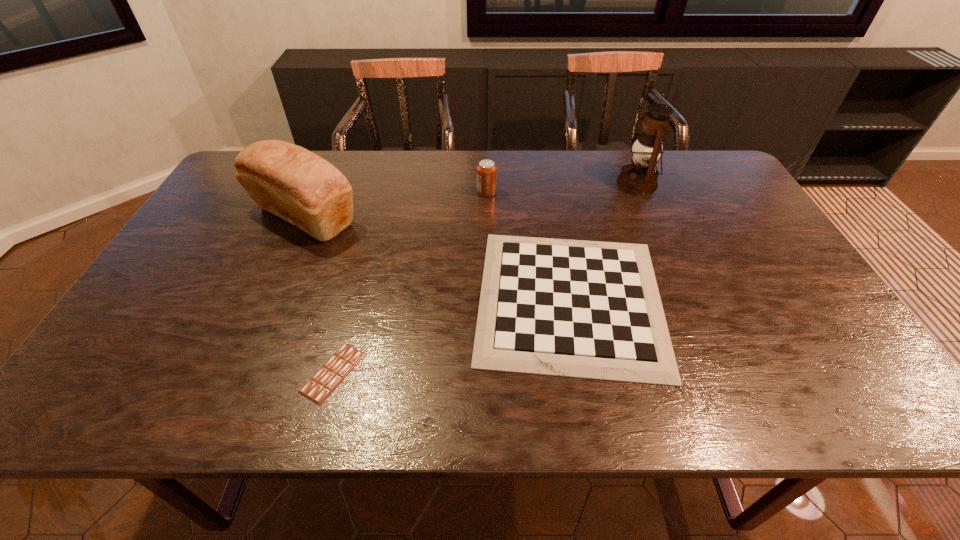
Identify the location of free spot between the second tallest object and the second shortest object. (438, 258).

Find the location of a particular element. free area in between the chocolate bar and the third shortest object is located at coordinates (410, 282).

Locate an element on the screen. The image size is (960, 540). the closest object relative to the can is located at coordinates (572, 308).

The image size is (960, 540). I want to click on object that is the fourth closest one to the can, so click(x=329, y=376).

This screenshot has width=960, height=540. I want to click on vacant position in the image that satisfies the following two spatial constraints: 1. on the side of the tallest object, there is a wick adjustment knob; 2. on the front side of the chocolate bar, so click(719, 373).

Identify the location of vacant region that satisfies the following two spatial constraints: 1. on the front side of the chocolate bar; 2. on the left side of the second tallest object. This screenshot has height=540, width=960. (235, 373).